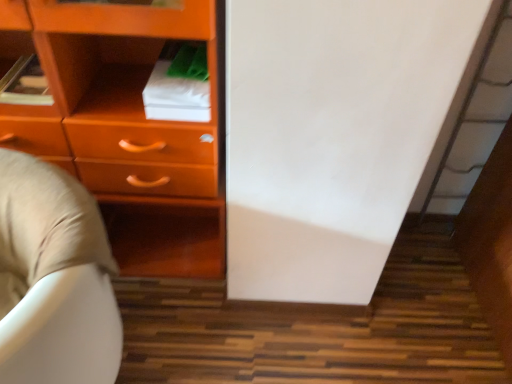
Question: Considering the positions of matte orange chest of drawers at left and beige fabric bean bag chair at lower left in the image, is matte orange chest of drawers at left bigger or smaller than beige fabric bean bag chair at lower left?

Choices:
 (A) small
 (B) big

Answer: (B)

Question: In terms of width, does matte orange chest of drawers at left look wider or thinner when compared to beige fabric bean bag chair at lower left?

Choices:
 (A) wide
 (B) thin

Answer: (A)

Question: From the image's perspective, is matte orange chest of drawers at left located above or below beige fabric bean bag chair at lower left?

Choices:
 (A) above
 (B) below

Answer: (A)

Question: Considering the positions of beige fabric bean bag chair at lower left and matte orange chest of drawers at left in the image, is beige fabric bean bag chair at lower left wider or thinner than matte orange chest of drawers at left?

Choices:
 (A) thin
 (B) wide

Answer: (A)

Question: Would you say beige fabric bean bag chair at lower left is to the left or to the right of matte orange chest of drawers at left in the picture?

Choices:
 (A) right
 (B) left

Answer: (B)

Question: In the image, is beige fabric bean bag chair at lower left positioned in front of or behind matte orange chest of drawers at left?

Choices:
 (A) front
 (B) behind

Answer: (A)

Question: From a real-world perspective, relative to matte orange chest of drawers at left, is beige fabric bean bag chair at lower left vertically above or below?

Choices:
 (A) above
 (B) below

Answer: (B)